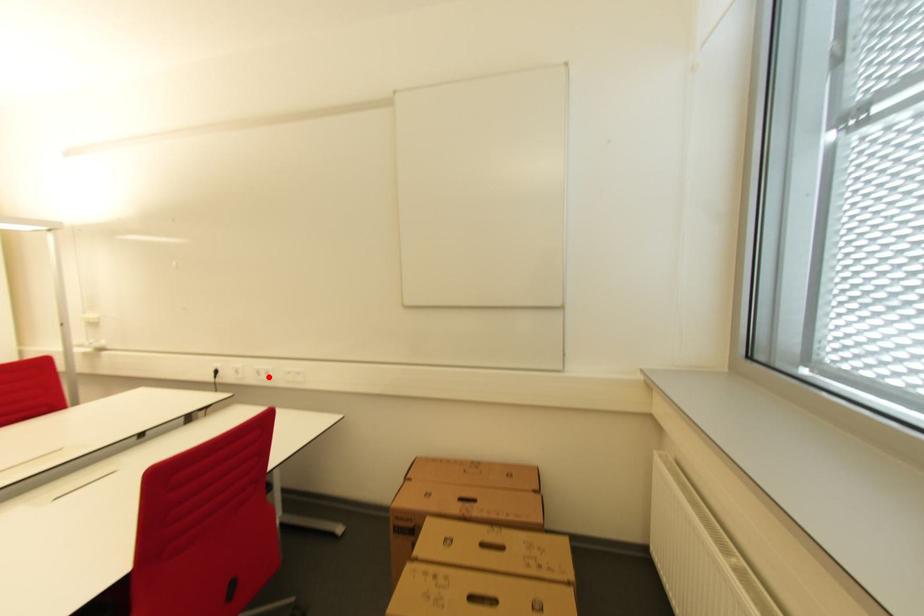
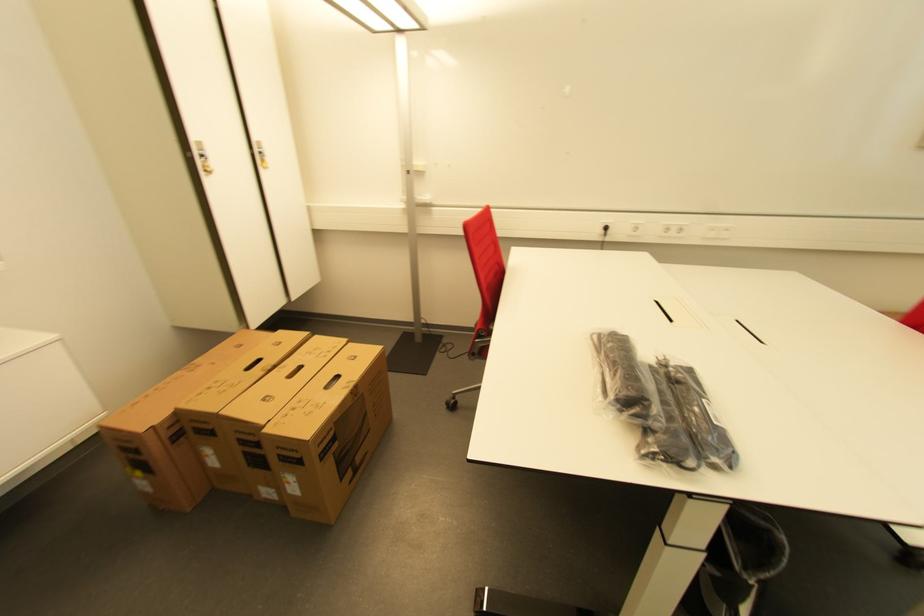
Where in the second image is the point corresponding to the highlighted location from the first image?

(676, 233)